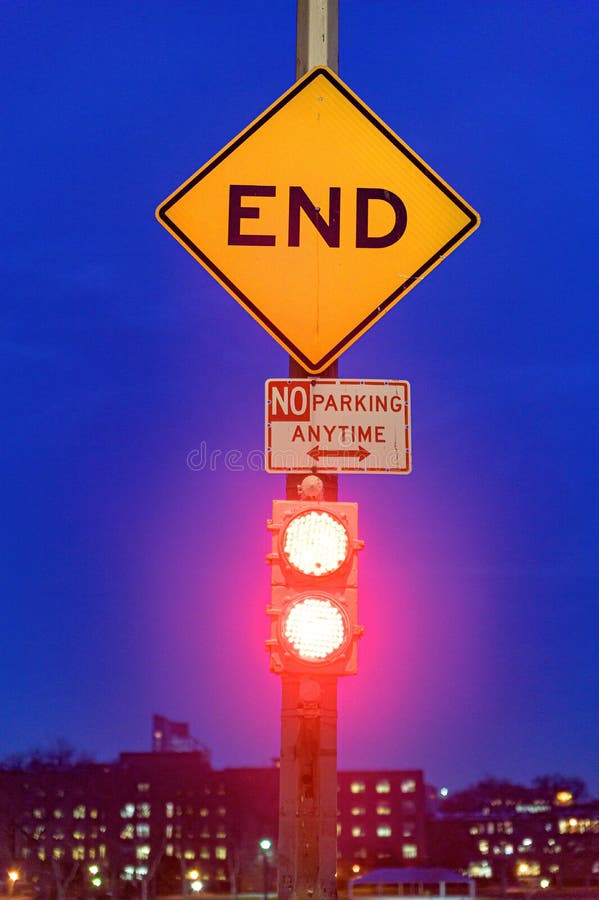
Where is `lights`? This screenshot has width=599, height=900. lights is located at coordinates (275, 604).